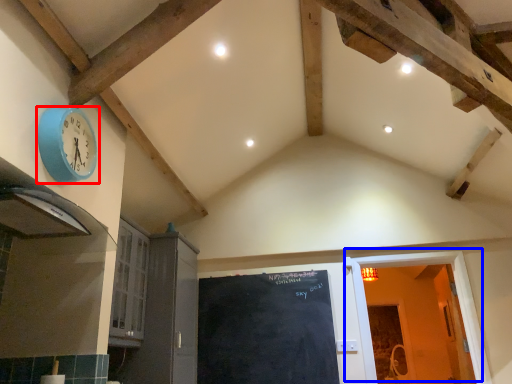
Question: Which point is further to the camera, wall clock (highlighted by a red box) or door (highlighted by a blue box)?

Choices:
 (A) wall clock
 (B) door

Answer: (B)